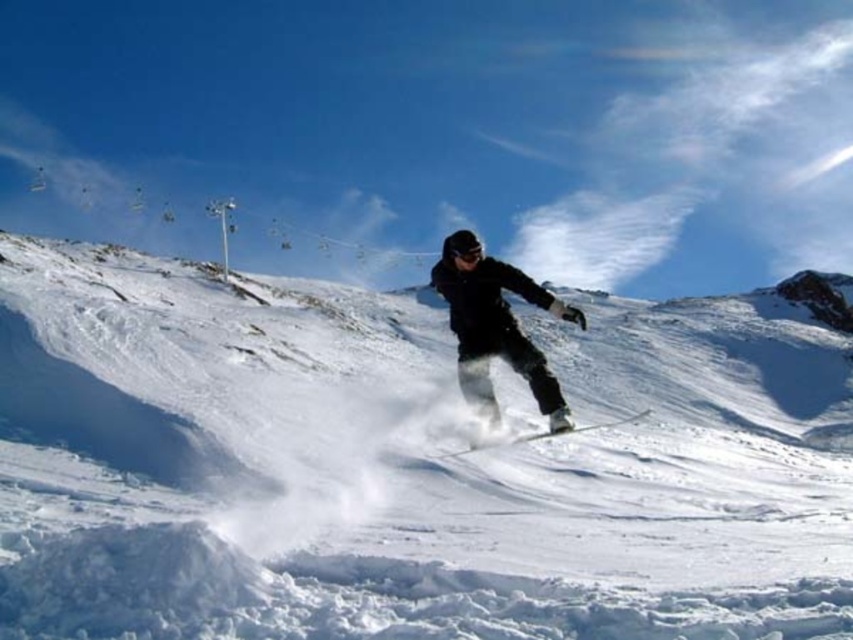
Question: From the image, what is the correct spatial relationship of white fluffy snow at center in relation to white matte ski at center?

Choices:
 (A) left
 (B) right

Answer: (A)

Question: Considering the relative positions of black matte snowboarder at center and white matte ski at center in the image provided, where is black matte snowboarder at center located with respect to white matte ski at center?

Choices:
 (A) above
 (B) below

Answer: (A)

Question: Which point is farther from the camera taking this photo?

Choices:
 (A) (537, 374)
 (B) (491, 444)
 (C) (15, 332)

Answer: (C)

Question: Among these points, which one is nearest to the camera?

Choices:
 (A) (593, 605)
 (B) (635, 417)

Answer: (A)

Question: Which of these objects is positioned closest to the white matte ski at center?

Choices:
 (A) black matte snowboarder at center
 (B) white fluffy snow at center

Answer: (A)

Question: Does white fluffy snow at center have a larger size compared to black matte snowboarder at center?

Choices:
 (A) yes
 (B) no

Answer: (A)